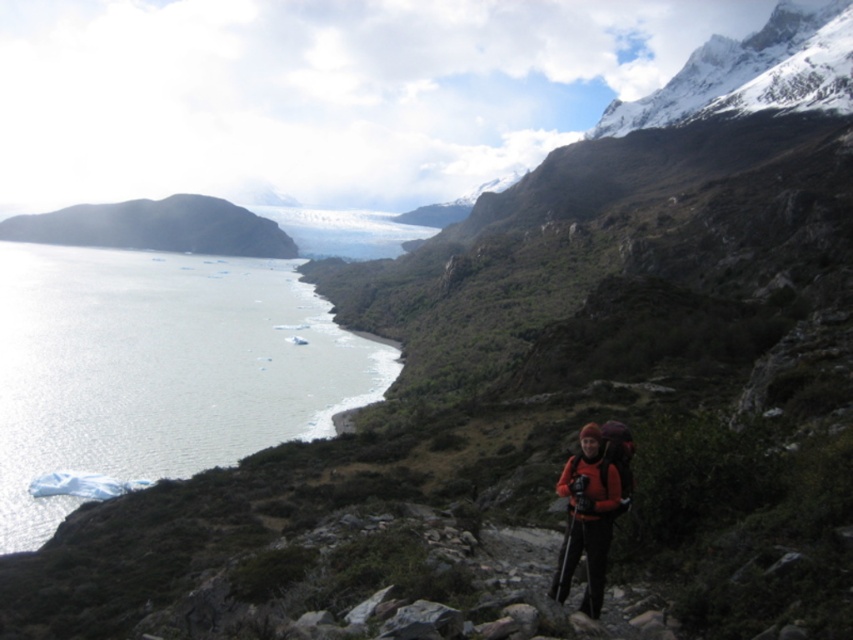
In the scene shown: Who is taller, clear water at left or orange fleece jacket at center?

clear water at left is taller.

Can you confirm if clear water at left is positioned to the left of orange fleece jacket at center?

Correct, you'll find clear water at left to the left of orange fleece jacket at center.

Is point (41, 529) more distant than point (585, 548)?

Yes, it is behind point (585, 548).

This screenshot has height=640, width=853. I want to click on clear water at left, so click(160, 369).